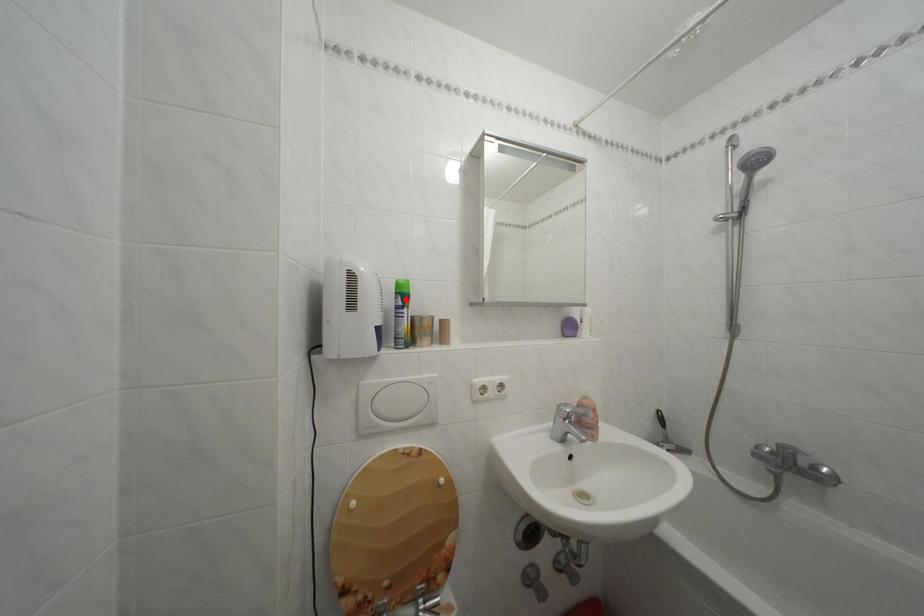
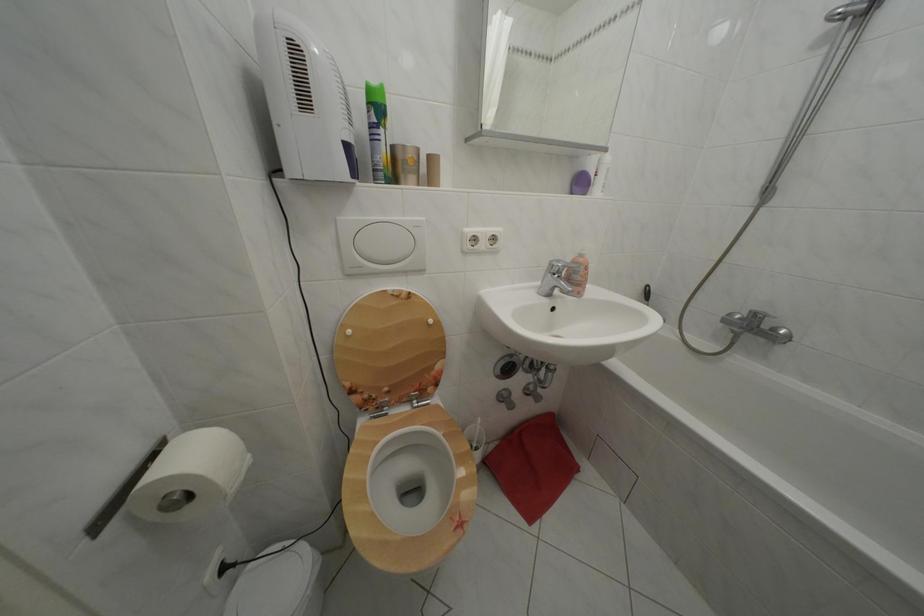
Question: I am providing you with two images of the same scene from different viewpoints. A red point is marked on the first image. At the location where the point appears in image 1, is it still visible in image 2?

Choices:
 (A) Yes
 (B) No

Answer: (A)